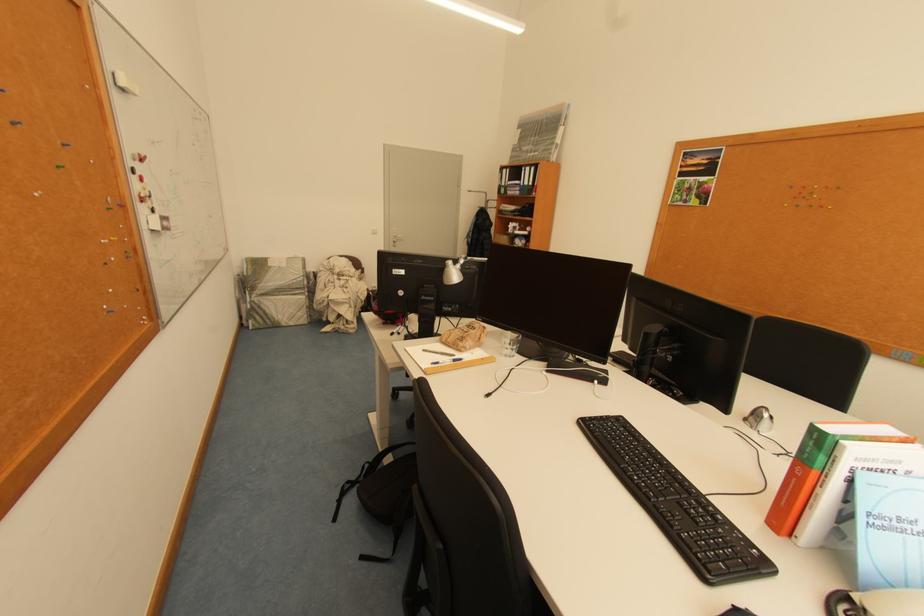
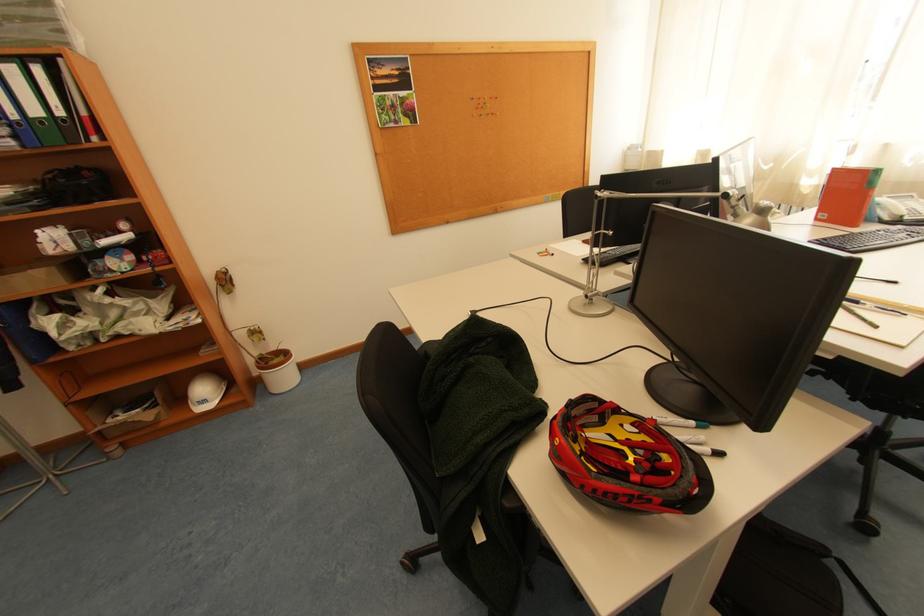
Locate, in the second image, the point that corresponds to (799,188) in the first image.

(480, 100)